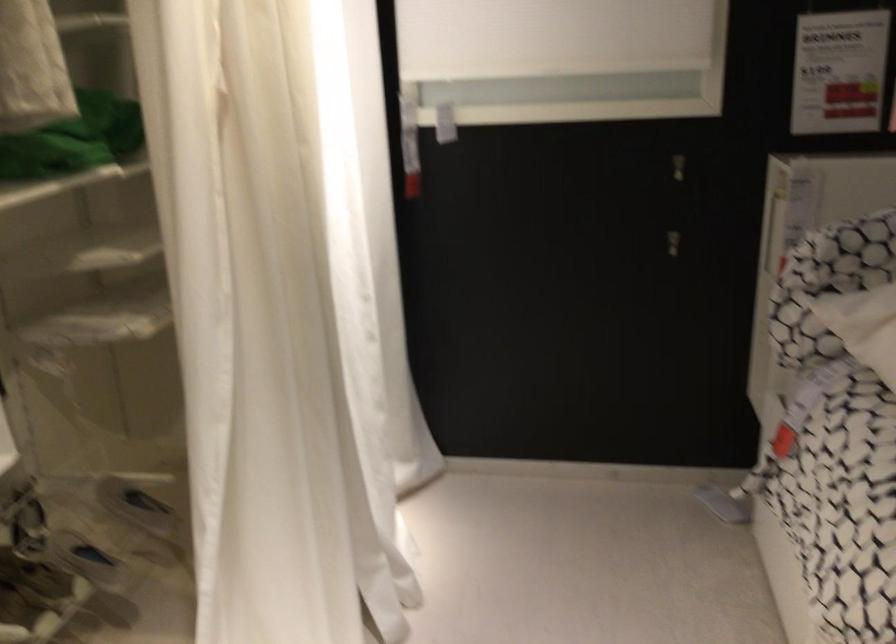
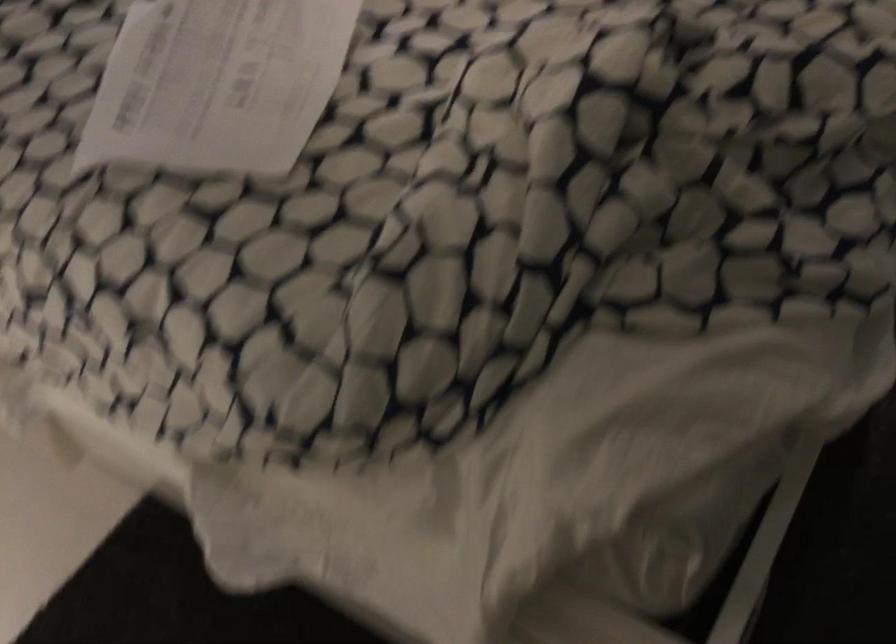
First-person continuous shooting, in which direction is the camera rotating?

The camera's rotation is toward right-down.